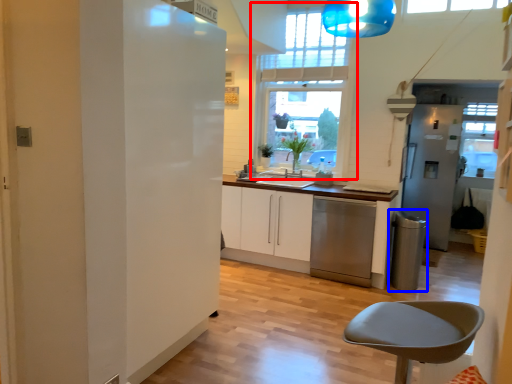
Question: Which object is further to the camera taking this photo, window (highlighted by a red box) or appliance (highlighted by a blue box)?

Choices:
 (A) window
 (B) appliance

Answer: (A)